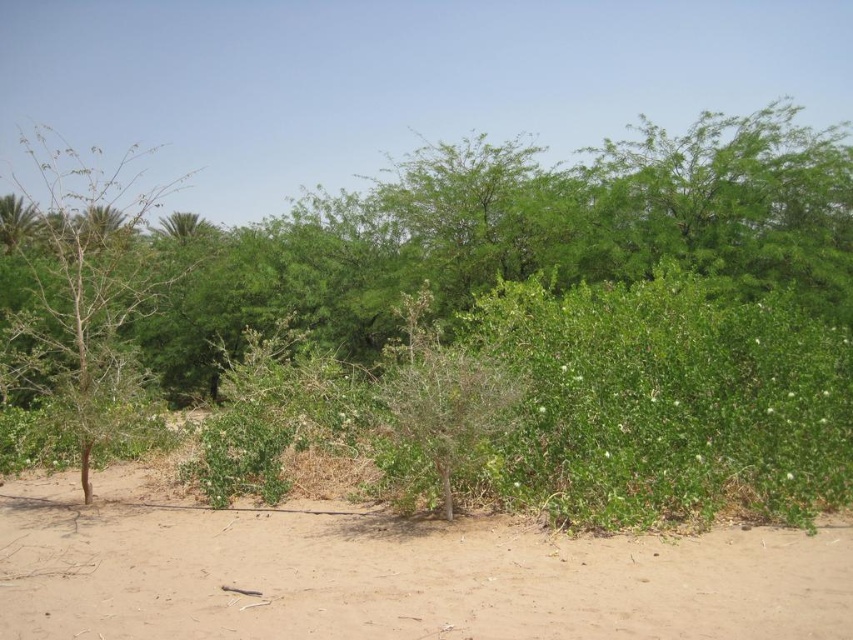
You are a hiker trying to find a path through the landscape. You notice the brown sandy dirt at center and the bare branches at left. Which one is lower to the ground?

The brown sandy dirt at center is lower to the ground than the bare branches at left because it is not as tall.

You are standing in the natural landscape described. You notice the brown sandy dirt at center and the bare branches at left. Which object is located to the right of the other?

The brown sandy dirt at center is located to the right of the bare branches at left.